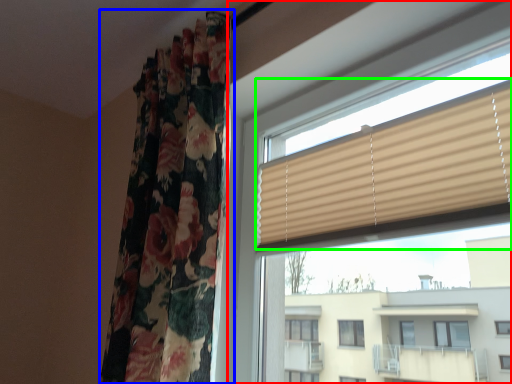
Question: Which object is positioned closest to window (highlighted by a red box)? Select from curtain (highlighted by a blue box) and window blind (highlighted by a green box).

Choices:
 (A) curtain
 (B) window blind

Answer: (B)